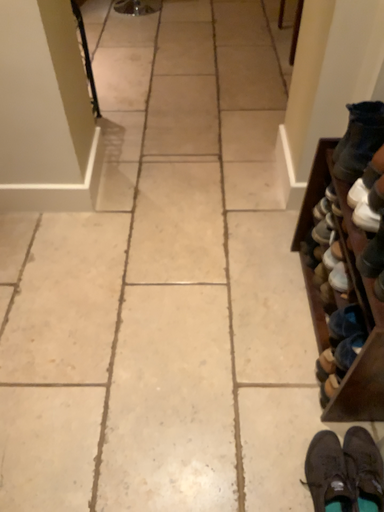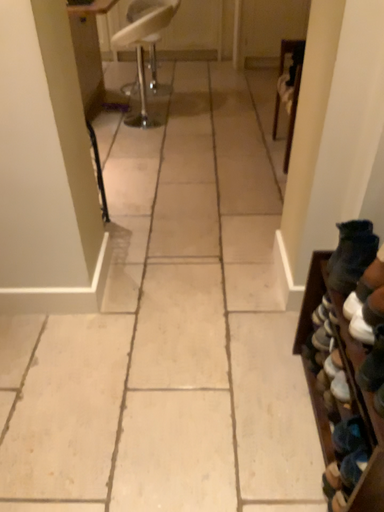
Question: How did the camera likely rotate when shooting the video?

Choices:
 (A) rotated upward
 (B) rotated downward

Answer: (A)